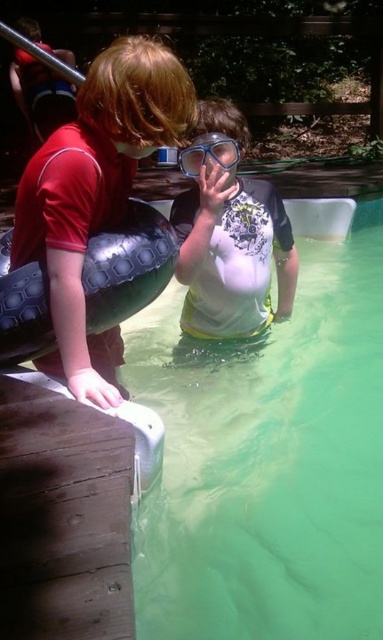
Question: Is green rubber pool at center further to camera compared to black rubber tire at left?

Choices:
 (A) no
 (B) yes

Answer: (A)

Question: Can you confirm if white matte swim trunks at center is thinner than transparent plastic goggles at center?

Choices:
 (A) no
 (B) yes

Answer: (A)

Question: Can you confirm if white matte swim trunks at center is positioned to the right of transparent plastic goggles at center?

Choices:
 (A) yes
 (B) no

Answer: (A)

Question: Estimate the real-world distances between objects in this image. Which object is farther from the white matte swim trunks at center?

Choices:
 (A) matte red shirt at left
 (B) black rubber tire at left
 (C) green rubber pool at center
 (D) transparent plastic goggles at center

Answer: (C)

Question: Which of these objects is positioned closest to the transparent plastic goggles at center?

Choices:
 (A) green rubber pool at center
 (B) black rubber tire at left
 (C) white matte swim trunks at center
 (D) matte red shirt at left

Answer: (C)

Question: Which object is the closest to the green rubber pool at center?

Choices:
 (A) matte red shirt at left
 (B) white matte swim trunks at center
 (C) transparent plastic goggles at center
 (D) black rubber tire at left

Answer: (B)